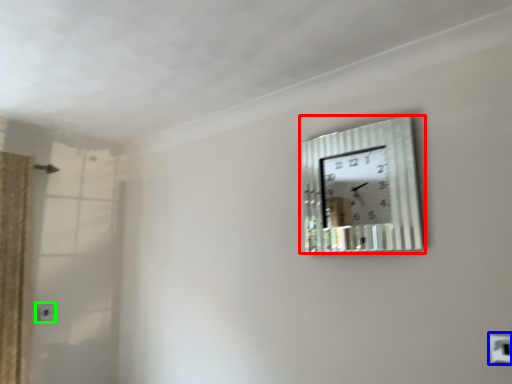
Question: Based on their relative distances, which object is nearer to wall clock (highlighted by a red box)? Choose from electric outlet (highlighted by a blue box) and electric outlet (highlighted by a green box).

Choices:
 (A) electric outlet
 (B) electric outlet

Answer: (A)